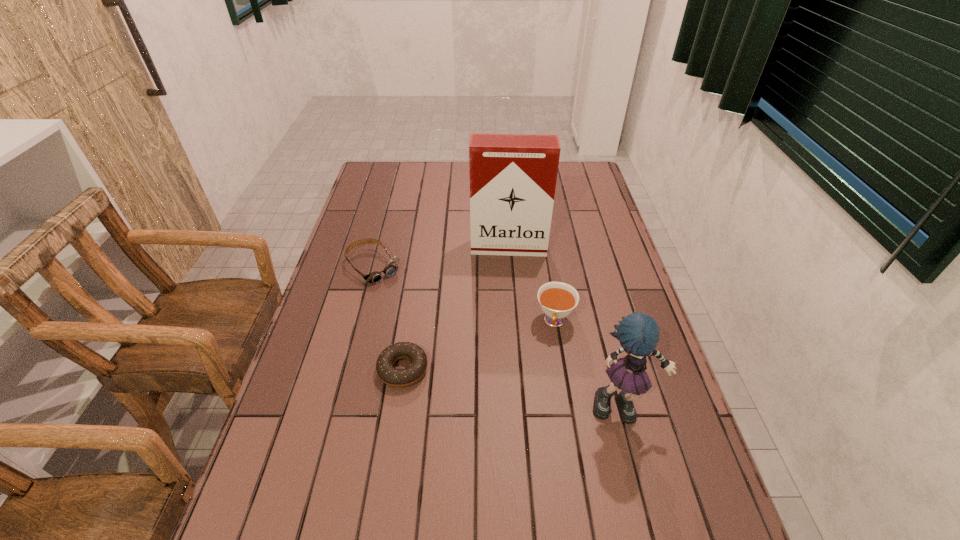
Locate an element on the screen. free region at the near edge is located at coordinates (357, 501).

Where is `blank area at the left edge`? The width and height of the screenshot is (960, 540). blank area at the left edge is located at coordinates (344, 246).

Locate an element on the screen. free space at the right edge is located at coordinates (584, 235).

This screenshot has width=960, height=540. In order to click on vacant space at the far left corner in this screenshot , I will do [x=401, y=175].

You are a GUI agent. You are given a task and a screenshot of the screen. Output one action in this format:
    pyautogui.click(x=<x>, y=<y>)
    Task: Click on the vacant area at the near right corner
    The image size is (960, 540).
    Given the screenshot: What is the action you would take?
    pyautogui.click(x=642, y=493)

Identify the location of empty space that is in between the fourth tallest object and the shortest object. Image resolution: width=960 pixels, height=540 pixels. tap(389, 318).

Where is `free spot between the tallest object and the rag doll`? This screenshot has width=960, height=540. free spot between the tallest object and the rag doll is located at coordinates (565, 327).

The image size is (960, 540). I want to click on free space that is in between the fourth shortest object and the goggles, so 498,337.

The height and width of the screenshot is (540, 960). I want to click on free space between the tallest object and the fourth shortest object, so coord(565,327).

Locate an element on the screen. The image size is (960, 540). free spot between the rag doll and the third nearest object is located at coordinates (588, 364).